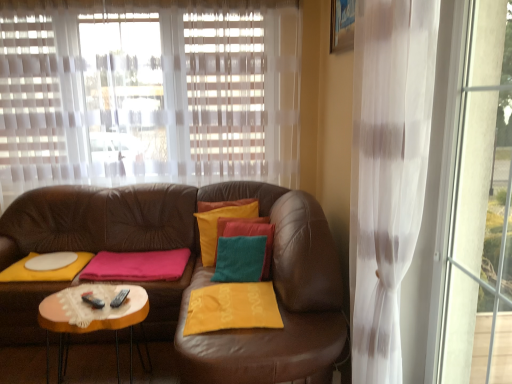
Question: Is translucent white curtain at upper center in front of or behind leather couch at center in the image?

Choices:
 (A) front
 (B) behind

Answer: (B)

Question: From the image's perspective, is translucent white curtain at upper center located above or below leather couch at center?

Choices:
 (A) below
 (B) above

Answer: (B)

Question: Considering the positions of translucent white curtain at upper center and leather couch at center in the image, is translucent white curtain at upper center wider or thinner than leather couch at center?

Choices:
 (A) wide
 (B) thin

Answer: (B)

Question: From a real-world perspective, is leather couch at center physically located above or below translucent white curtain at upper center?

Choices:
 (A) above
 (B) below

Answer: (B)

Question: In terms of width, does leather couch at center look wider or thinner when compared to translucent white curtain at upper center?

Choices:
 (A) thin
 (B) wide

Answer: (B)

Question: In the image, is leather couch at center on the left side or the right side of translucent white curtain at upper center?

Choices:
 (A) right
 (B) left

Answer: (B)

Question: Considering the positions of leather couch at center and translucent white curtain at upper center in the image, is leather couch at center taller or shorter than translucent white curtain at upper center?

Choices:
 (A) tall
 (B) short

Answer: (A)